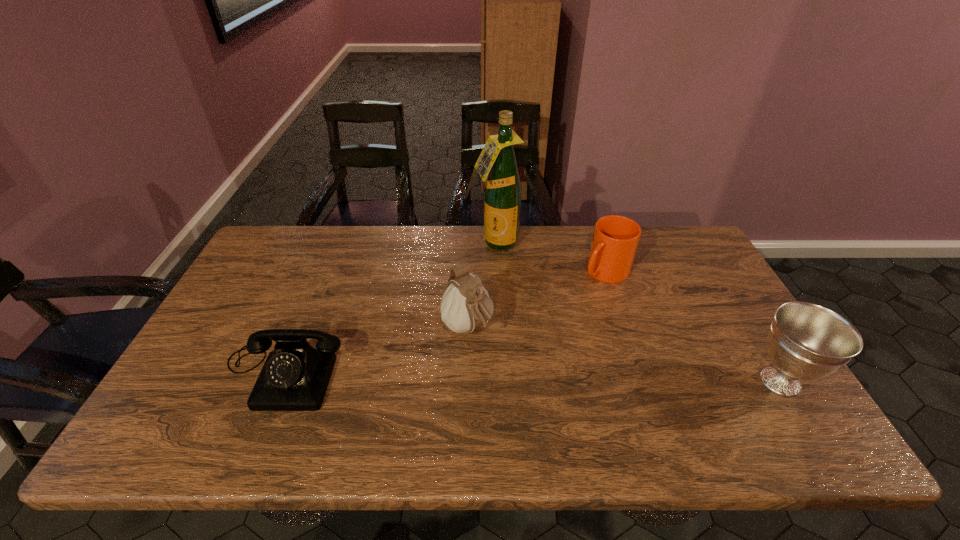
What are the coordinates of `vacant region that satisfies the following two spatial constraints: 1. on the front face of the leftmost object; 2. on the left side of the rightmost object` in the screenshot? It's located at (279, 381).